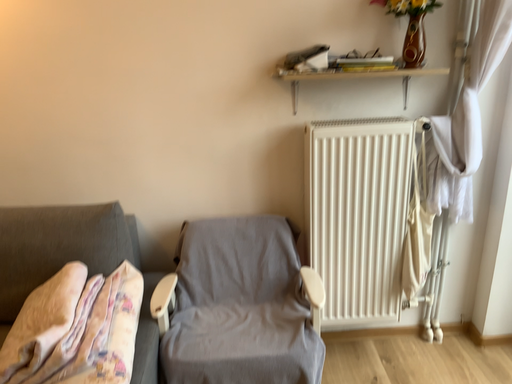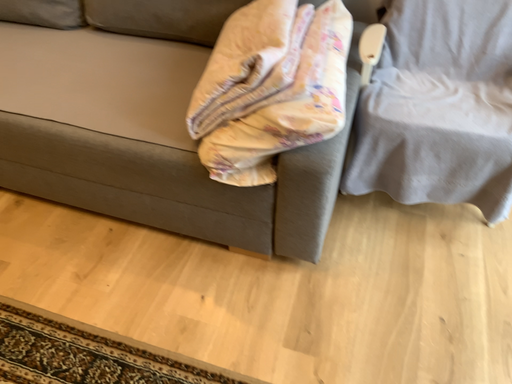
Question: How did the camera likely rotate when shooting the video?

Choices:
 (A) rotated left
 (B) rotated right

Answer: (A)